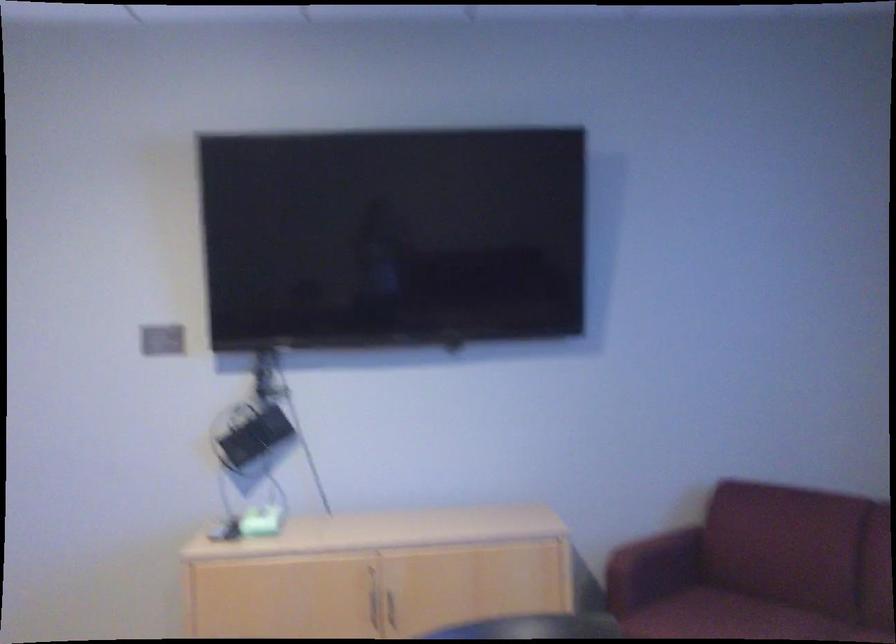
In order to click on red chair sitting surface in this screenshot , I will do `click(722, 616)`.